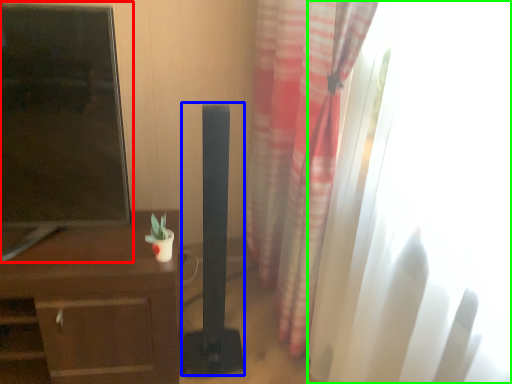
Question: Considering the real-world distances, which object is closest to tv show (highlighted by a red box)? speaker (highlighted by a blue box) or window (highlighted by a green box).

Choices:
 (A) speaker
 (B) window

Answer: (A)